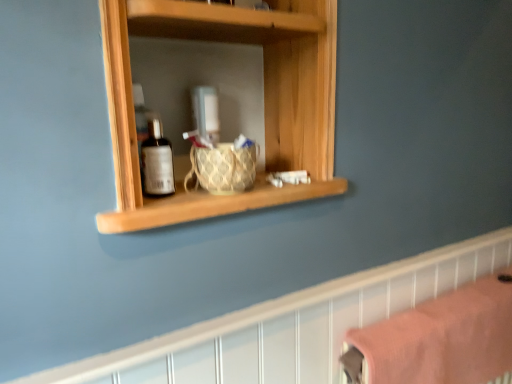
Question: Can you confirm if pink fabric towel at lower right is wider than wooden shelf at upper center?

Choices:
 (A) yes
 (B) no

Answer: (A)

Question: From the image's perspective, is pink fabric towel at lower right beneath wooden shelf at upper center?

Choices:
 (A) yes
 (B) no

Answer: (A)

Question: Does pink fabric towel at lower right turn towards wooden shelf at upper center?

Choices:
 (A) yes
 (B) no

Answer: (A)

Question: From a real-world perspective, is pink fabric towel at lower right located higher than wooden shelf at upper center?

Choices:
 (A) yes
 (B) no

Answer: (B)

Question: Is pink fabric towel at lower right positioned before wooden shelf at upper center?

Choices:
 (A) yes
 (B) no

Answer: (B)

Question: Based on their sizes in the image, would you say wooden shelf at upper center is bigger or smaller than wooden shelf at center?

Choices:
 (A) big
 (B) small

Answer: (B)

Question: In terms of width, does wooden shelf at upper center look wider or thinner when compared to wooden shelf at center?

Choices:
 (A) thin
 (B) wide

Answer: (A)

Question: Considering their positions, is wooden shelf at upper center located in front of or behind wooden shelf at center?

Choices:
 (A) front
 (B) behind

Answer: (B)

Question: From the image's perspective, is wooden shelf at upper center positioned above or below wooden shelf at center?

Choices:
 (A) below
 (B) above

Answer: (A)

Question: Is wooden shelf at center to the left or to the right of woven fabric basket at center in the image?

Choices:
 (A) left
 (B) right

Answer: (A)

Question: Looking at the image, does wooden shelf at center seem bigger or smaller compared to woven fabric basket at center?

Choices:
 (A) small
 (B) big

Answer: (B)

Question: Considering the positions of wooden shelf at center and woven fabric basket at center in the image, is wooden shelf at center wider or thinner than woven fabric basket at center?

Choices:
 (A) wide
 (B) thin

Answer: (A)

Question: Is wooden shelf at center spatially inside woven fabric basket at center, or outside of it?

Choices:
 (A) outside
 (B) inside

Answer: (A)

Question: From the image's perspective, is woven fabric basket at center positioned above or below pink fabric towel at lower right?

Choices:
 (A) below
 (B) above

Answer: (B)

Question: In the image, is woven fabric basket at center on the left side or the right side of pink fabric towel at lower right?

Choices:
 (A) left
 (B) right

Answer: (A)